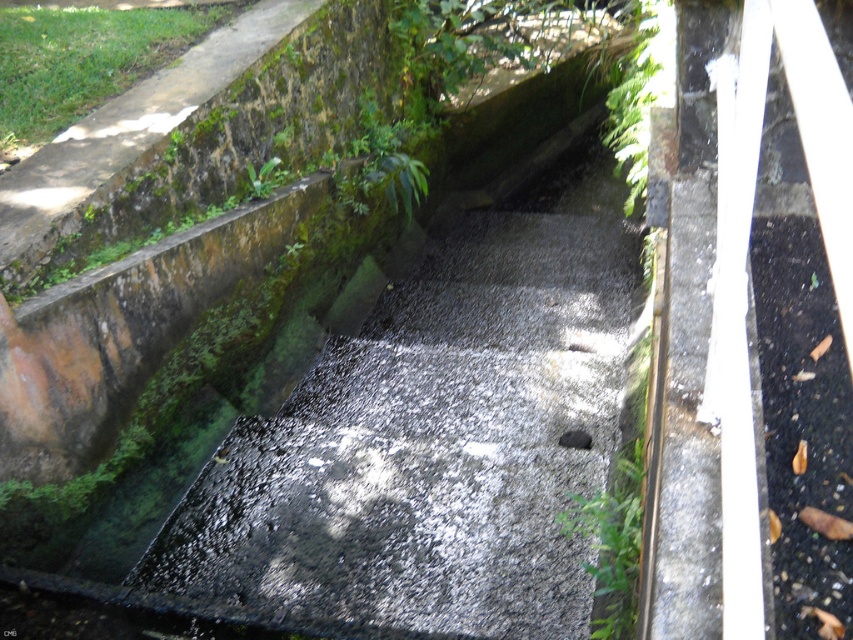
Question: Which of the following is the closest to the observer?

Choices:
 (A) (576, 442)
 (B) (456, 449)

Answer: (B)

Question: Among these objects, which one is farthest from the camera?

Choices:
 (A) gray concrete at center
 (B) black concrete drain at center

Answer: (B)

Question: Does gray concrete at center appear on the right side of black concrete drain at center?

Choices:
 (A) yes
 (B) no

Answer: (B)

Question: From the image, what is the correct spatial relationship of gray concrete at center in relation to black concrete drain at center?

Choices:
 (A) below
 (B) above

Answer: (B)

Question: Considering the relative positions of gray concrete at center and black concrete drain at center in the image provided, where is gray concrete at center located with respect to black concrete drain at center?

Choices:
 (A) right
 (B) left

Answer: (B)